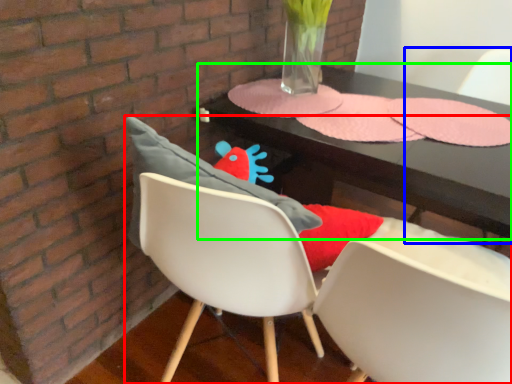
Question: Estimate the real-world distances between objects in this image. Which object is farther from chair (highlighted by a red box), armchair (highlighted by a blue box) or table (highlighted by a green box)?

Choices:
 (A) armchair
 (B) table

Answer: (A)